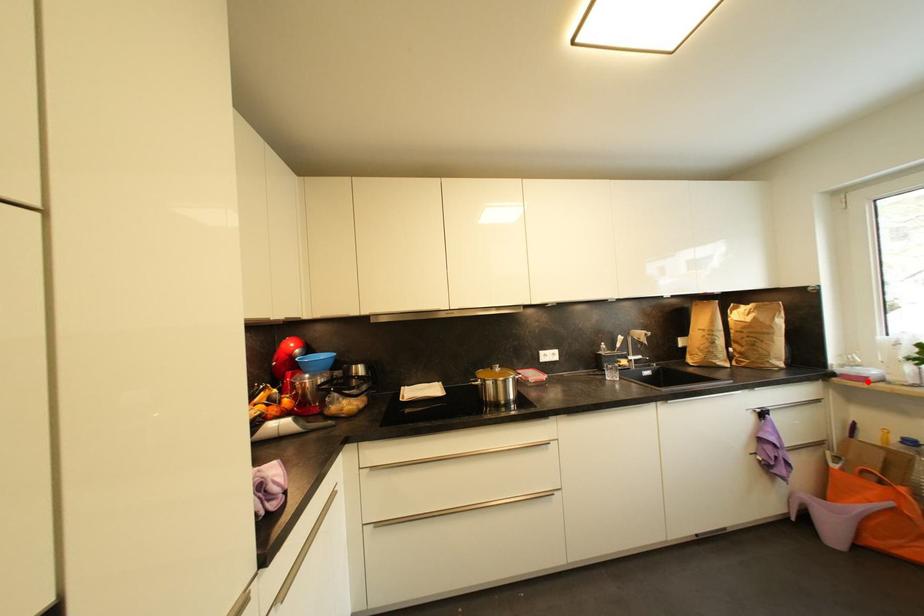
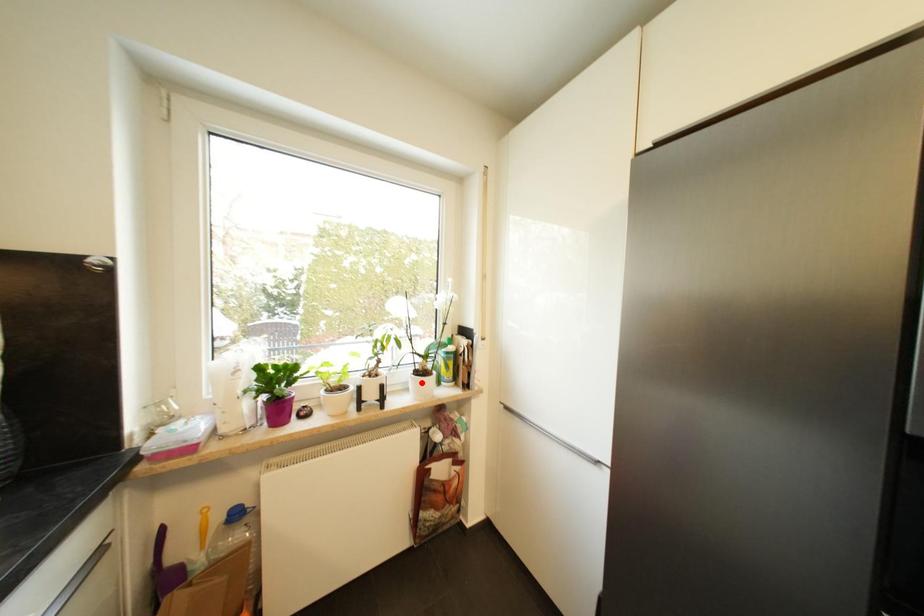
I am providing you with two images of the same scene from different viewpoints. A red point is marked on the first image and another point is marked on the second image. Does the point marked in image1 correspond to the same location as the one in image2?

No